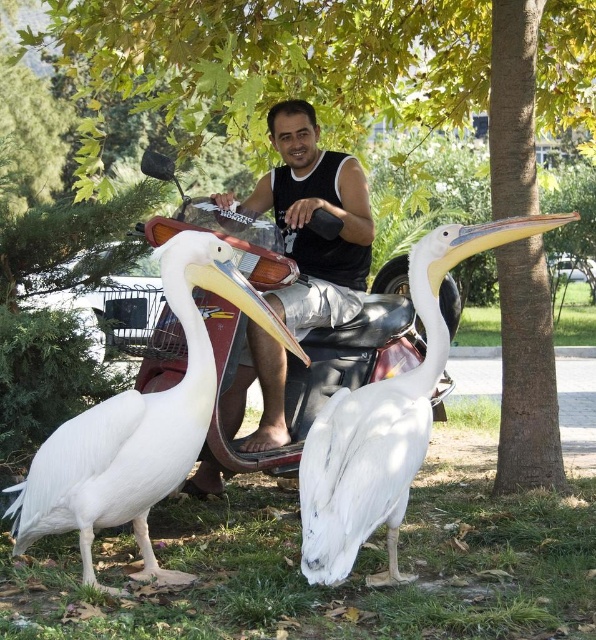
I want to click on white feathered pelican at center, so click(386, 420).

Does point (454, 256) come closer to viewer compared to point (330, 308)?

Yes, it is.

Locate an element on the screen. This screenshot has height=640, width=596. white feathered pelican at center is located at coordinates (386, 420).

Who is taller, white matte pelican at center or white feathered pelican at center?

white feathered pelican at center is taller.

Measure the distance from white matte pelican at center to white feathered pelican at center.

A distance of 18.93 inches exists between white matte pelican at center and white feathered pelican at center.

Between point (193, 387) and point (476, 243), which one is positioned in front?

Point (193, 387) is in front.

I want to click on white matte pelican at center, so click(x=139, y=426).

Measure the distance between white matte pelican at center and black matte tank top at center.

Answer: white matte pelican at center and black matte tank top at center are 36.17 inches apart.

Is point (145, 499) more distant than point (355, 284)?

No, (145, 499) is closer to viewer.

The width and height of the screenshot is (596, 640). I want to click on white matte pelican at center, so click(x=139, y=426).

Find the location of `white matte pelican at center`. white matte pelican at center is located at coordinates (139, 426).